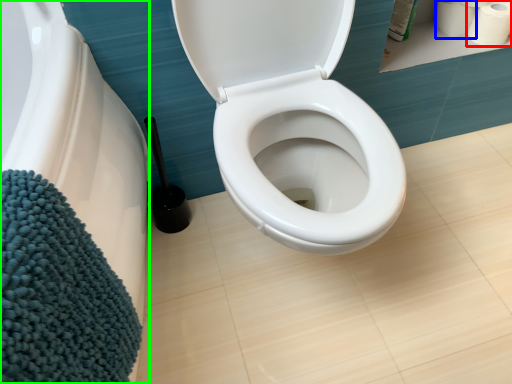
Question: Estimate the real-world distances between objects in this image. Which object is closer to toilet paper (highlighted by a red box), toilet paper (highlighted by a blue box) or bath (highlighted by a green box)?

Choices:
 (A) toilet paper
 (B) bath

Answer: (A)